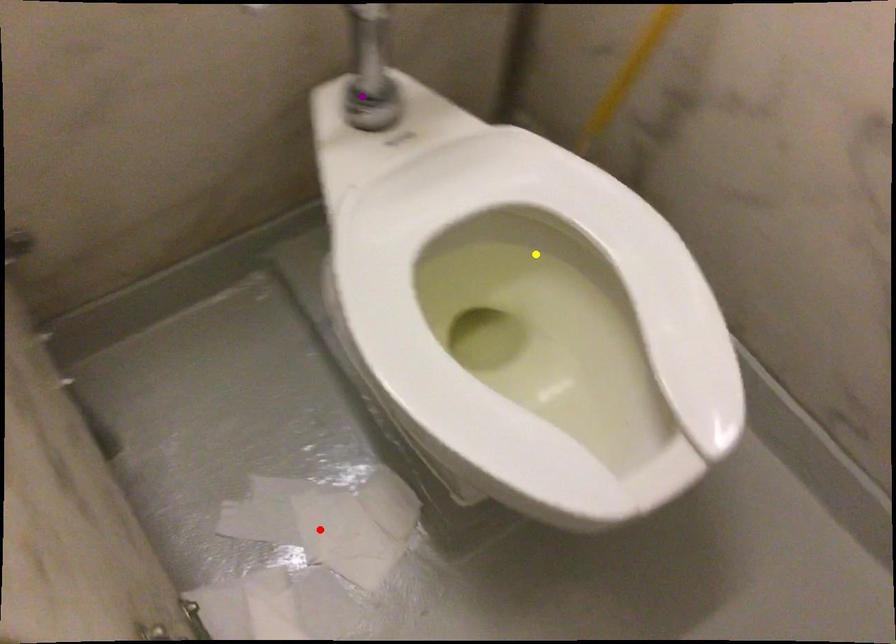
Order these from nearest to farthest:
yellow point | red point | purple point

red point → purple point → yellow point